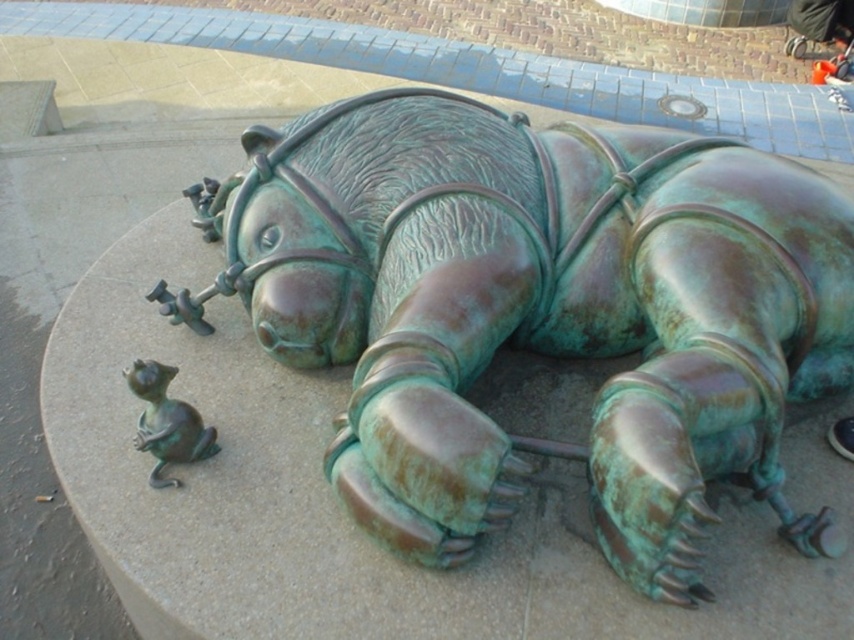
You are an art curator planning to move the green patina mouse at lower left closer to the green patina horse at center for an exhibition. The minimum distance required between the two statues for safety is 24 inches. Based on their current spacing, can you safely move them to the minimum distance without violating safety guidelines?

The green patina horse at center and green patina mouse at lower left are currently 24.73 inches apart. Since the minimum safety distance is 24 inches, reducing the distance to exactly 24 inches would meet the requirement. Therefore, moving the mouse closer to achieve the minimum distance is safe as it does not go below the required 24 inches.

You are standing in front of the bronze sculptures and want to take a photo of both the green patina horse at center and the green patina mouse at lower left. Which sculpture should you focus on first to ensure both are in focus?

You should focus on the green patina horse at center first because it is closer to you than the green patina mouse at lower left, so adjusting focus from near to far will help both be in focus.